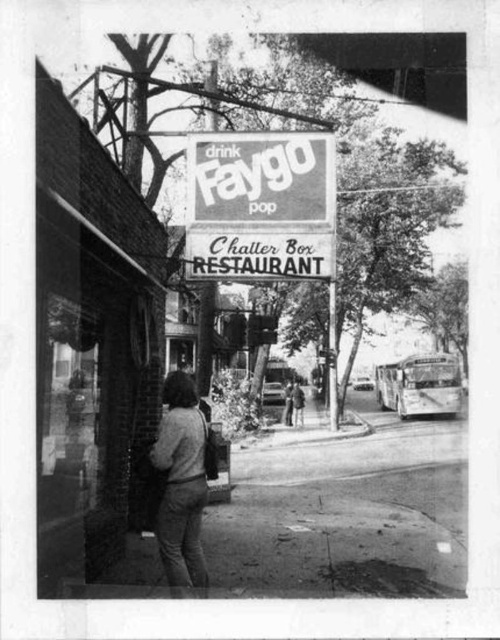
Can you confirm if brick wall at left is shorter than smooth leather jacket at center?

In fact, brick wall at left may be taller than smooth leather jacket at center.

Is point (49, 458) more distant than point (303, 420)?

No.

Find the location of a particular element. brick wall at left is located at coordinates [90, 340].

Based on the photo, can you confirm if matte gray sweater at center is positioned above smooth leather jacket at center?

Correct, matte gray sweater at center is located above smooth leather jacket at center.

Is matte gray sweater at center to the right of smooth leather jacket at center from the viewer's perspective?

No, matte gray sweater at center is not to the right of smooth leather jacket at center.

Is point (168, 416) farther from camera compared to point (295, 381)?

No, (168, 416) is in front of (295, 381).

You are a GUI agent. You are given a task and a screenshot of the screen. Output one action in this format:
    pyautogui.click(x=<x>, y=<y>)
    Task: Click on the matte gray sweater at center
    
    Given the screenshot: What is the action you would take?
    pyautogui.click(x=182, y=484)

Who is lower down, white paper sign at center or matte gray sweater at center?

matte gray sweater at center is below.

Which is more to the left, white paper sign at center or matte gray sweater at center?

matte gray sweater at center is more to the left.

Is point (290, 154) in front of point (177, 560)?

No.

Where is `white paper sign at center`? white paper sign at center is located at coordinates (261, 205).